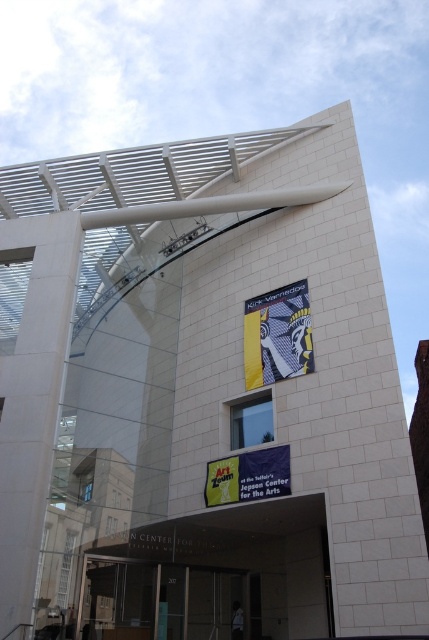
You are standing at the entrance of the Art Zeum and need to move from the white concrete pillar at left to the abstract patterned fabric at center. If you walk directly towards the fabric, will you have enough space to pass through the area between them?

The distance between the white concrete pillar at left and the abstract patterned fabric at center is 51.21 feet, which is more than enough space to pass through comfortably.

You are standing in front of the modern building and want to take a photo of the yellow fabric banner at center. However, there is a white concrete pillar at left in the way. Can you move to the right to avoid the pillar and still capture the banner in your shot?

The white concrete pillar at left is closer to the viewer than the yellow fabric banner at center, so moving to the right would allow you to avoid the pillar while still capturing the banner in your photo since the banner is further back and not blocked by the pillar.

You are standing in front of the modern building and want to take a photo of the yellow fabric banner at center without the abstract patterned fabric at center blocking the view. Is this possible given their positions?

The yellow fabric banner at center is behind the abstract patterned fabric at center, so taking a photo of the yellow fabric banner at center without the abstract patterned fabric at center blocking the view is not possible as it is in front.